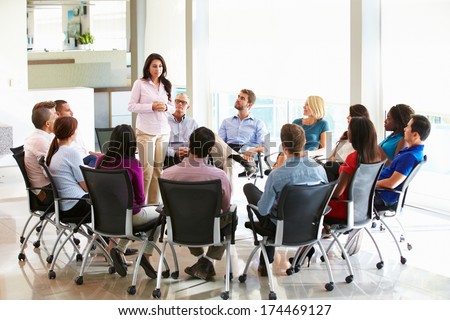
Image resolution: width=450 pixels, height=320 pixels. What are the coordinates of `chairs` in the screenshot? It's located at (106, 213), (198, 218), (58, 219), (32, 209), (287, 218), (365, 206), (403, 192), (98, 138).